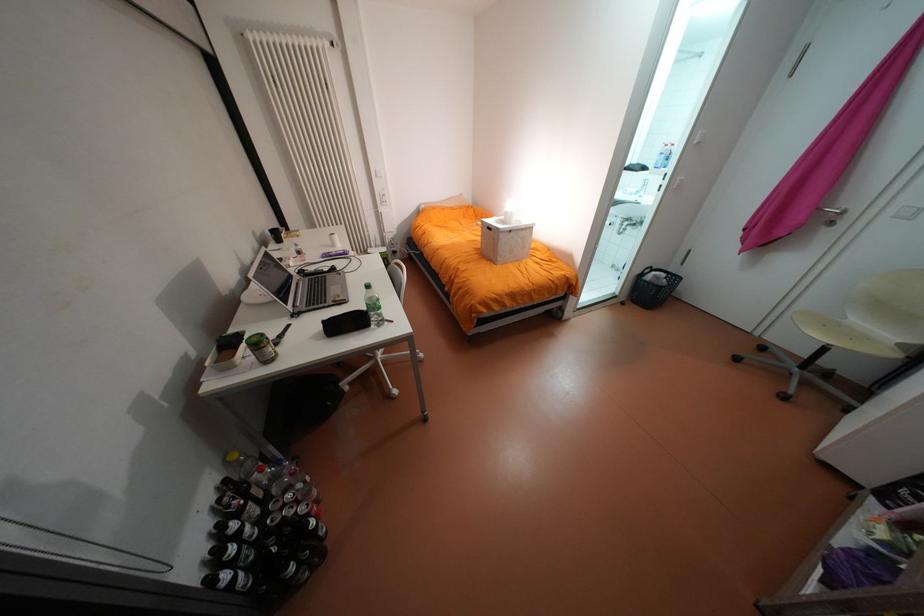
What do you see at coordinates (382, 195) in the screenshot?
I see `the white light switch` at bounding box center [382, 195].